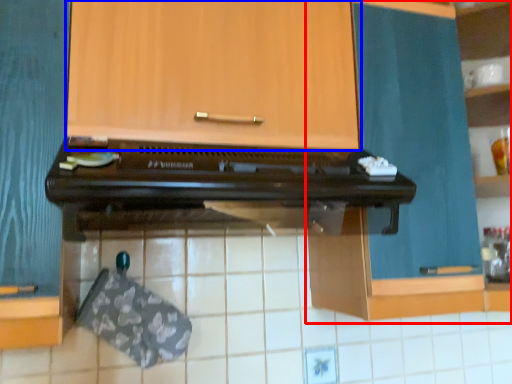
Question: Which point is closer to the camera, cabinetry (highlighted by a red box) or cabinetry (highlighted by a blue box)?

Choices:
 (A) cabinetry
 (B) cabinetry

Answer: (B)